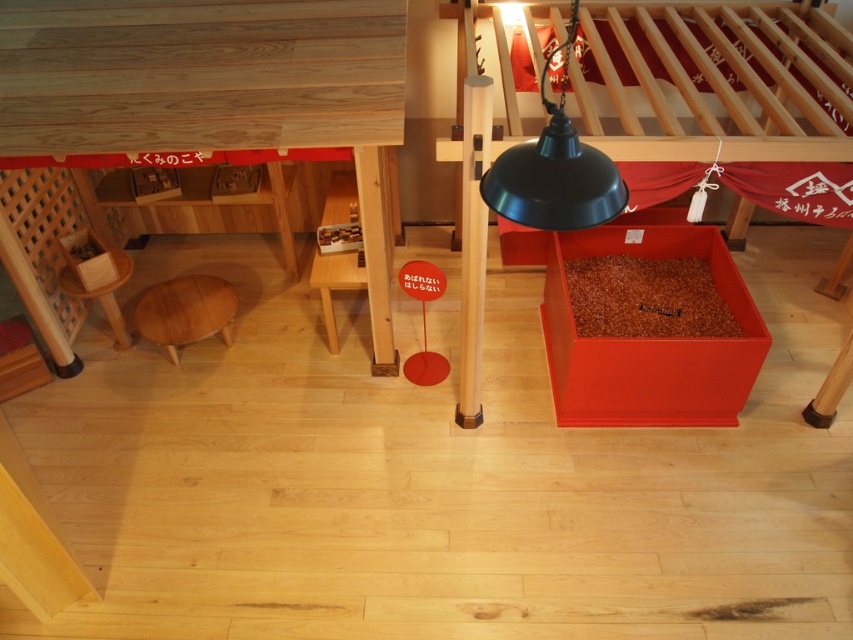
Question: Can you confirm if black matte lamp at upper center is positioned below light brown wooden stool at lower left?

Choices:
 (A) yes
 (B) no

Answer: (B)

Question: Which object is positioned closest to the black matte lamp at upper center?

Choices:
 (A) light brown wooden stool at lower left
 (B) wooden table at lower left

Answer: (B)

Question: Estimate the real-world distances between objects in this image. Which object is closer to the light brown wooden stool at lower left?

Choices:
 (A) black matte lamp at upper center
 (B) wooden table at lower left

Answer: (B)

Question: Which of these objects is positioned closest to the light brown wooden stool at lower left?

Choices:
 (A) black matte lamp at upper center
 (B) wooden table at lower left

Answer: (B)

Question: Where is black matte lamp at upper center located in relation to light brown wooden stool at lower left in the image?

Choices:
 (A) above
 (B) below

Answer: (A)

Question: Is wooden table at lower left wider than black matte lamp at upper center?

Choices:
 (A) no
 (B) yes

Answer: (B)